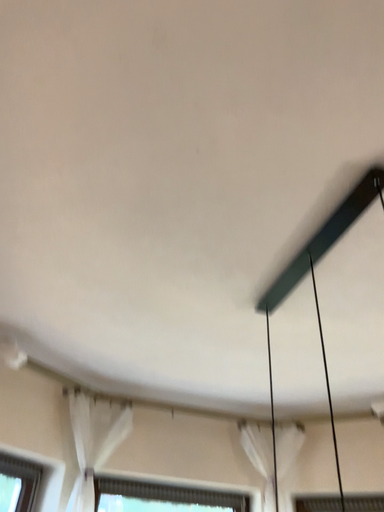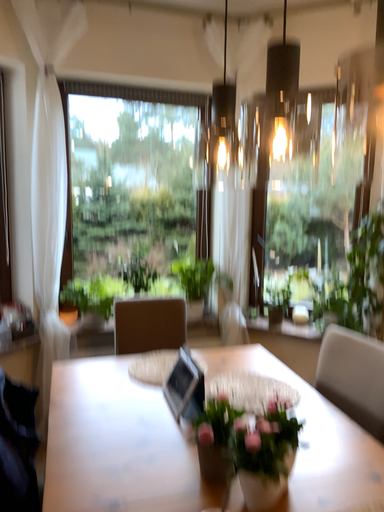
Question: How did the camera likely rotate when shooting the video?

Choices:
 (A) rotated downward
 (B) rotated upward

Answer: (A)